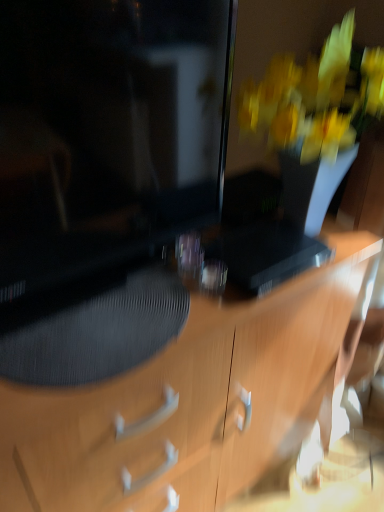
Question: From a real-world perspective, is black textured drawer at center positioned under wooden desk at center based on gravity?

Choices:
 (A) no
 (B) yes

Answer: (A)

Question: Does black textured drawer at center lie behind wooden desk at center?

Choices:
 (A) yes
 (B) no

Answer: (A)

Question: Does black textured drawer at center have a greater height compared to wooden desk at center?

Choices:
 (A) no
 (B) yes

Answer: (A)

Question: From a real-world perspective, is black textured drawer at center on top of wooden desk at center?

Choices:
 (A) yes
 (B) no

Answer: (A)

Question: Is black textured drawer at center bigger than wooden desk at center?

Choices:
 (A) yes
 (B) no

Answer: (B)

Question: In terms of width, does matte black monitor at left look wider or thinner when compared to black textured drawer at center?

Choices:
 (A) wide
 (B) thin

Answer: (B)

Question: Is matte black monitor at left situated inside black textured drawer at center or outside?

Choices:
 (A) outside
 (B) inside

Answer: (A)

Question: Is matte black monitor at left taller or shorter than black textured drawer at center?

Choices:
 (A) tall
 (B) short

Answer: (A)

Question: Is point (147, 245) closer or farther from the camera than point (132, 470)?

Choices:
 (A) closer
 (B) farther

Answer: (B)

Question: From a real-world perspective, is wooden desk at center physically located above or below black textured drawer at center?

Choices:
 (A) below
 (B) above

Answer: (A)

Question: Considering the positions of wooden desk at center and black textured drawer at center in the image, is wooden desk at center wider or thinner than black textured drawer at center?

Choices:
 (A) wide
 (B) thin

Answer: (A)

Question: Is wooden desk at center situated inside black textured drawer at center or outside?

Choices:
 (A) inside
 (B) outside

Answer: (B)

Question: Considering the relative positions of wooden desk at center and black textured drawer at center in the image provided, is wooden desk at center to the left or to the right of black textured drawer at center?

Choices:
 (A) right
 (B) left

Answer: (A)

Question: In terms of size, does wooden desk at center appear bigger or smaller than matte black monitor at left?

Choices:
 (A) small
 (B) big

Answer: (B)

Question: Is wooden desk at center to the left or to the right of matte black monitor at left in the image?

Choices:
 (A) left
 (B) right

Answer: (B)